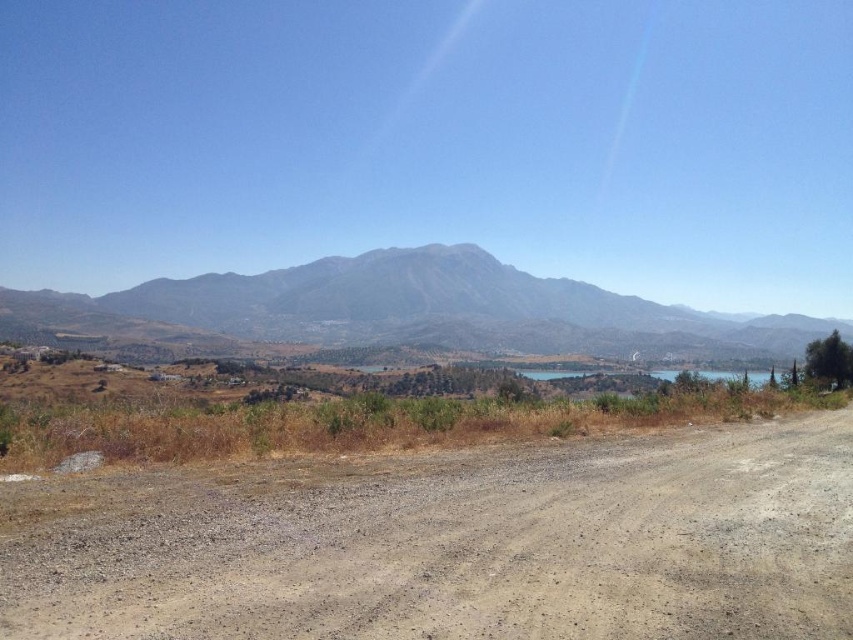
Can you confirm if brown gravel dirt track at lower left is taller than gray rocky mountain at center?

Answer: Incorrect, brown gravel dirt track at lower left's height is not larger of gray rocky mountain at center's.

Who is higher up, brown gravel dirt track at lower left or gray rocky mountain at center?

Positioned higher is gray rocky mountain at center.

This screenshot has width=853, height=640. I want to click on brown gravel dirt track at lower left, so click(451, 544).